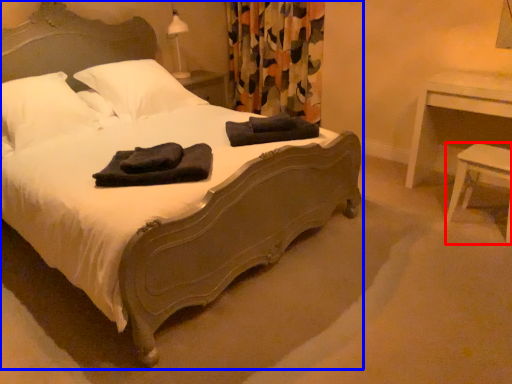
Question: Which point is further to the camera, stool (highlighted by a red box) or bed (highlighted by a blue box)?

Choices:
 (A) stool
 (B) bed

Answer: (A)